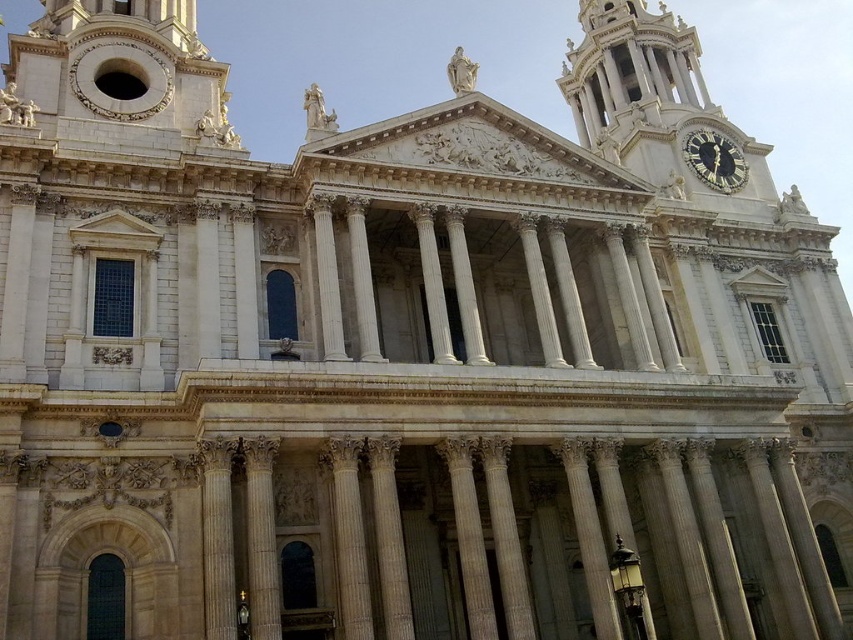
Question: Which object is closer to the camera taking this photo?

Choices:
 (A) gold metallic clock at upper right
 (B) white marble column at center

Answer: (B)

Question: Which of the following is the farthest from the observer?

Choices:
 (A) gold metallic clock at upper right
 (B) white marble column at center

Answer: (A)

Question: Is the position of white marble column at center more distant than that of gold metallic clock at upper right?

Choices:
 (A) yes
 (B) no

Answer: (B)

Question: Is white marble column at center to the left of gold metallic clock at upper right from the viewer's perspective?

Choices:
 (A) yes
 (B) no

Answer: (A)

Question: Among these points, which one is farthest from the camera?

Choices:
 (A) (x=714, y=134)
 (B) (x=343, y=460)

Answer: (A)

Question: Is white marble column at center positioned behind gold metallic clock at upper right?

Choices:
 (A) no
 (B) yes

Answer: (A)